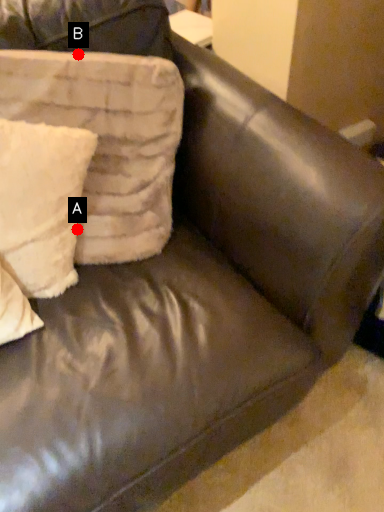
Question: Two points are circled on the image, labeled by A and B beside each circle. Which point is farther from the camera taking this photo?

Choices:
 (A) A is further
 (B) B is further

Answer: (A)